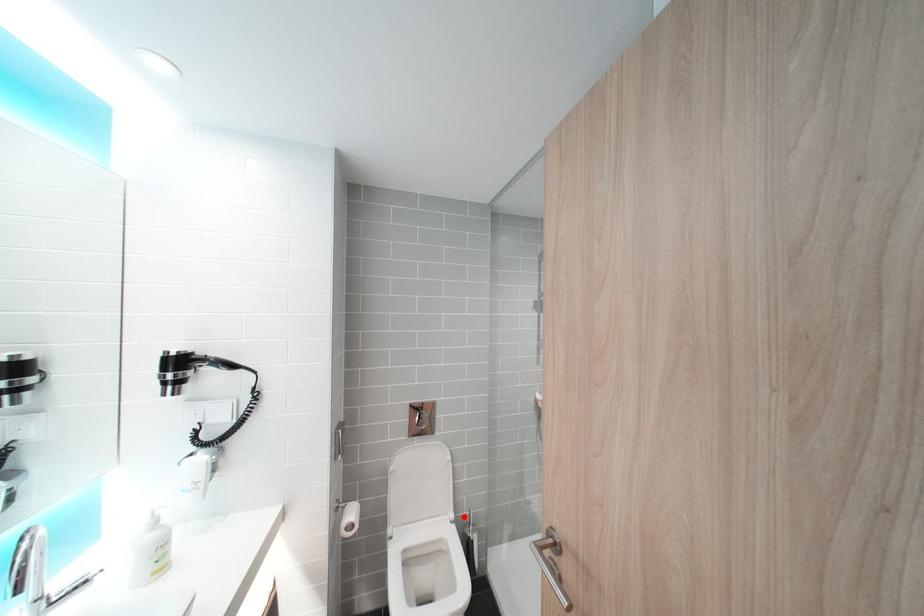
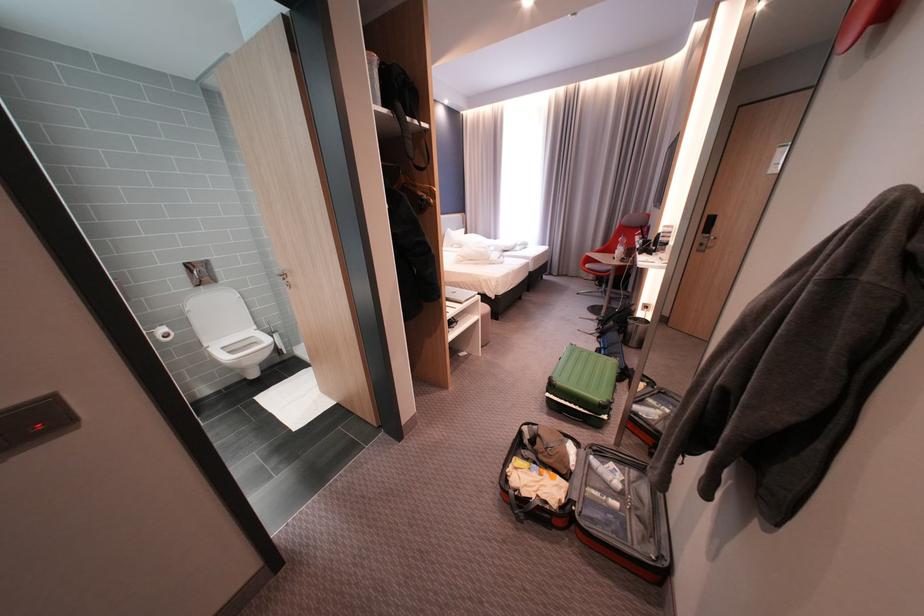
Question: I am providing you with two images of the same scene from different viewpoints. In image1, a red point is highlighted. Considering the same 3D point in image2, which of the following is correct?

Choices:
 (A) It is closer
 (B) It is farther

Answer: (A)